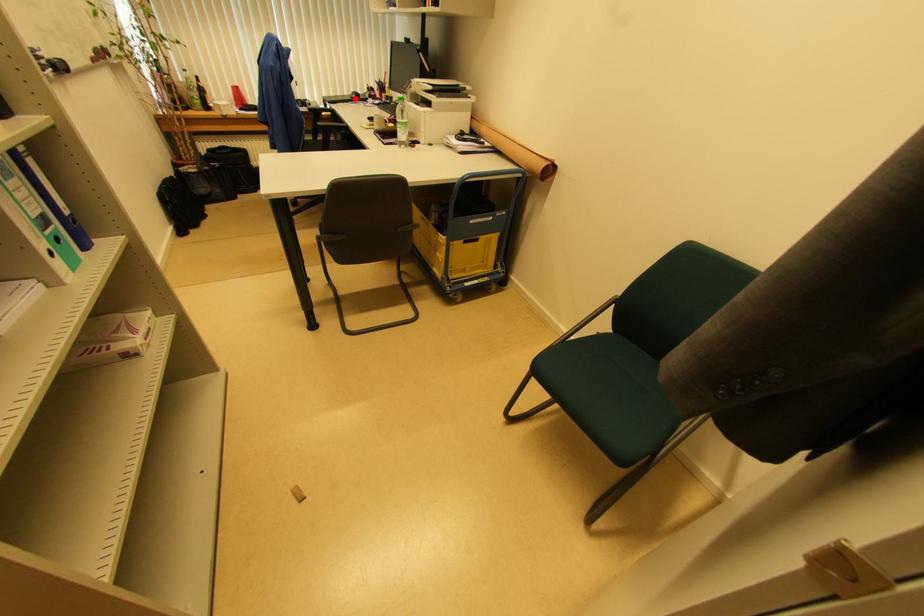
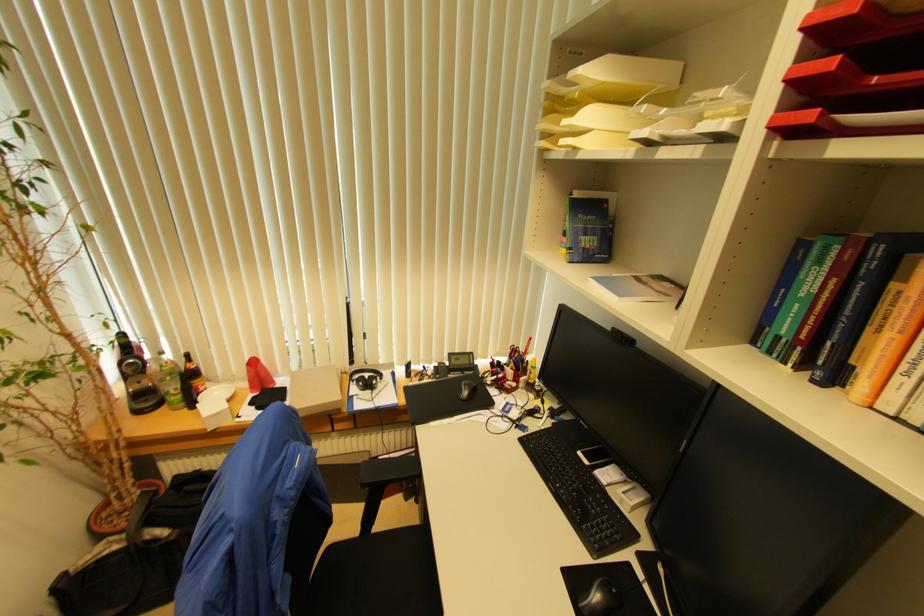
In the second image, find the point that corresponds to the highlighted location in the first image.

(467, 395)